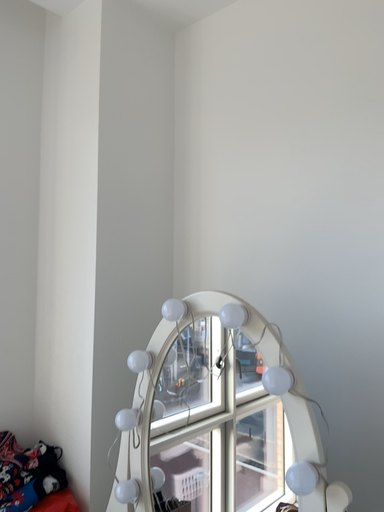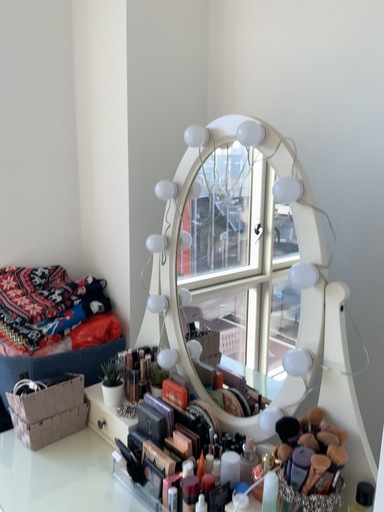
Question: Which way did the camera rotate in the video?

Choices:
 (A) rotated downward
 (B) rotated upward

Answer: (A)